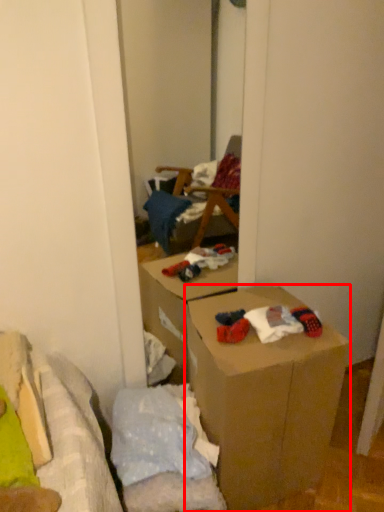
Question: From the image's perspective, where is box (annotated by the red box) located relative to toy?

Choices:
 (A) above
 (B) below

Answer: (B)